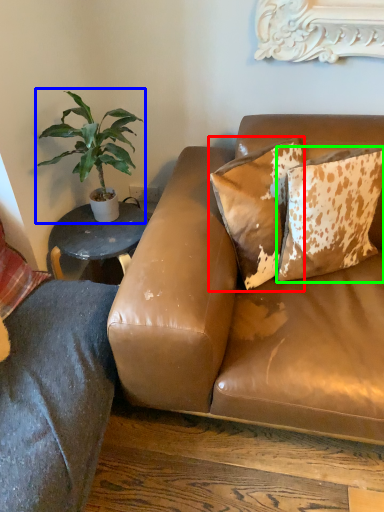
Question: Estimate the real-world distances between objects in this image. Which object is farther from pillow (highlighted by a red box), houseplant (highlighted by a blue box) or pillow (highlighted by a green box)?

Choices:
 (A) houseplant
 (B) pillow

Answer: (A)